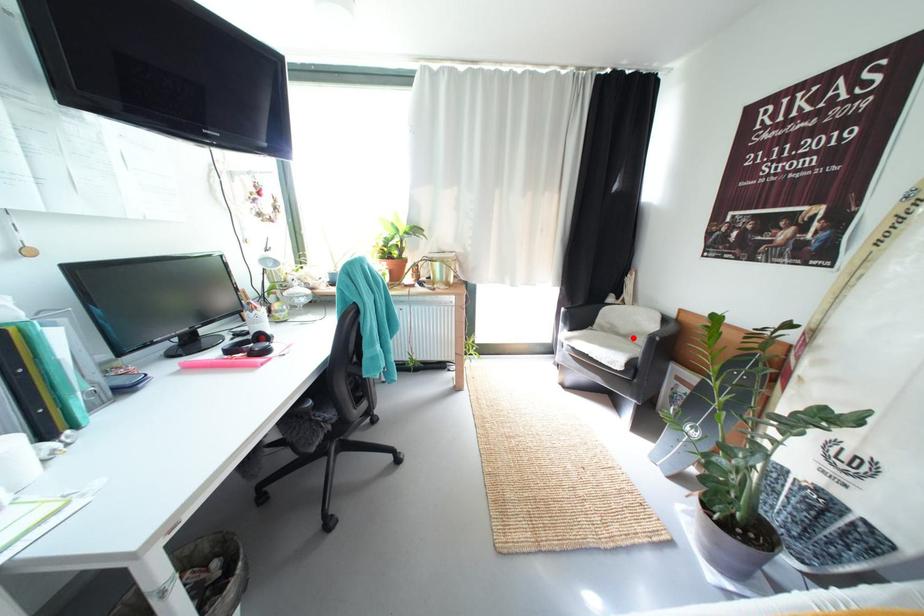
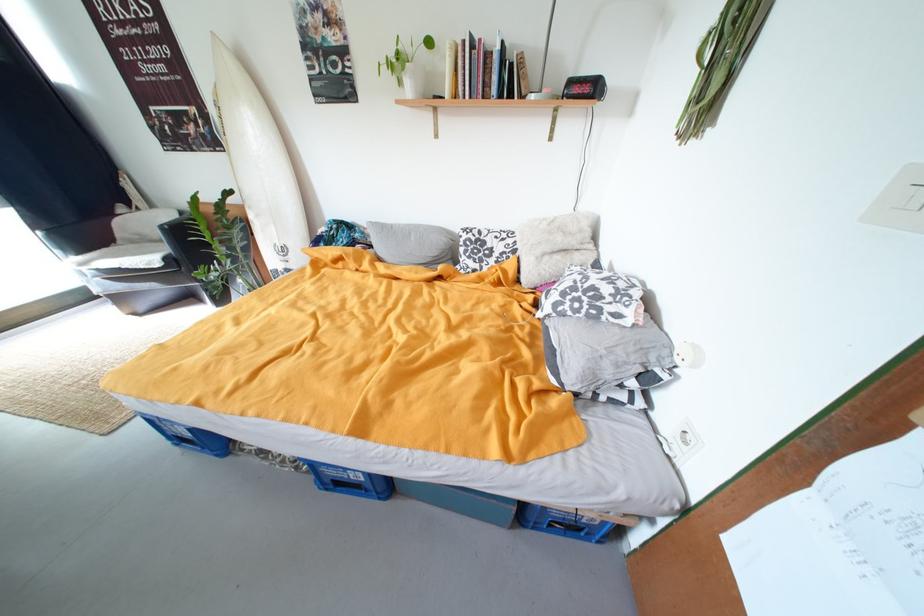
The point at the highlighted location is marked in the first image. Where is the corresponding point in the second image?

(169, 243)